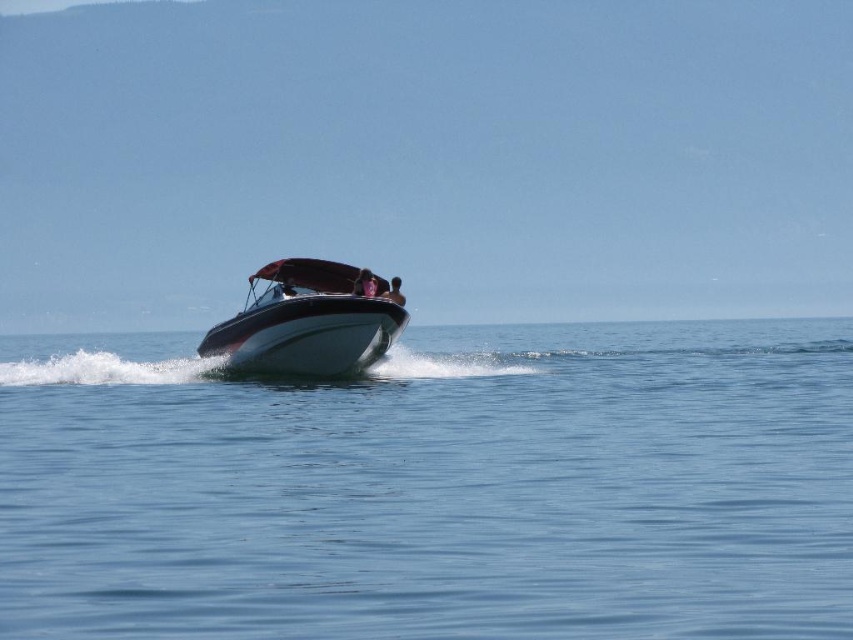
Question: Can you confirm if blue smooth water at center is positioned to the left of smooth leather jacket at center?

Choices:
 (A) no
 (B) yes

Answer: (B)

Question: Estimate the real-world distances between objects in this image. Which object is closer to the glossy white boat at center?

Choices:
 (A) blue smooth water at center
 (B) smooth leather jacket at center

Answer: (B)

Question: Which point appears closest to the camera in this image?

Choices:
 (A) coord(364,289)
 (B) coord(160,468)
 (C) coord(390,278)
 (D) coord(328,321)

Answer: (B)

Question: Observing the image, what is the correct spatial positioning of glossy white boat at center in reference to smooth skin face at center?

Choices:
 (A) below
 (B) above

Answer: (A)

Question: Does blue smooth water at center have a larger size compared to smooth skin face at center?

Choices:
 (A) no
 (B) yes

Answer: (B)

Question: Which point appears farthest from the camera in this image?

Choices:
 (A) (363, 285)
 (B) (204, 627)

Answer: (A)